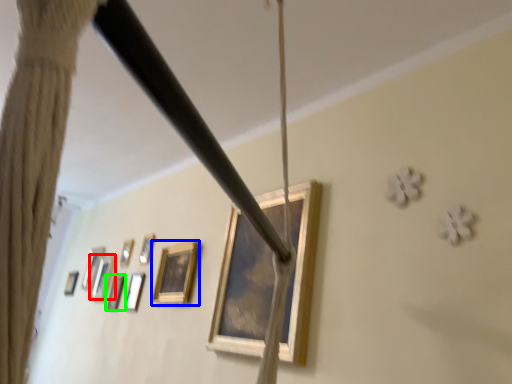
Question: Estimate the real-world distances between objects in this image. Which object is closer to picture frame (highlighted by a red box), picture frame (highlighted by a blue box) or picture frame (highlighted by a green box)?

Choices:
 (A) picture frame
 (B) picture frame

Answer: (B)